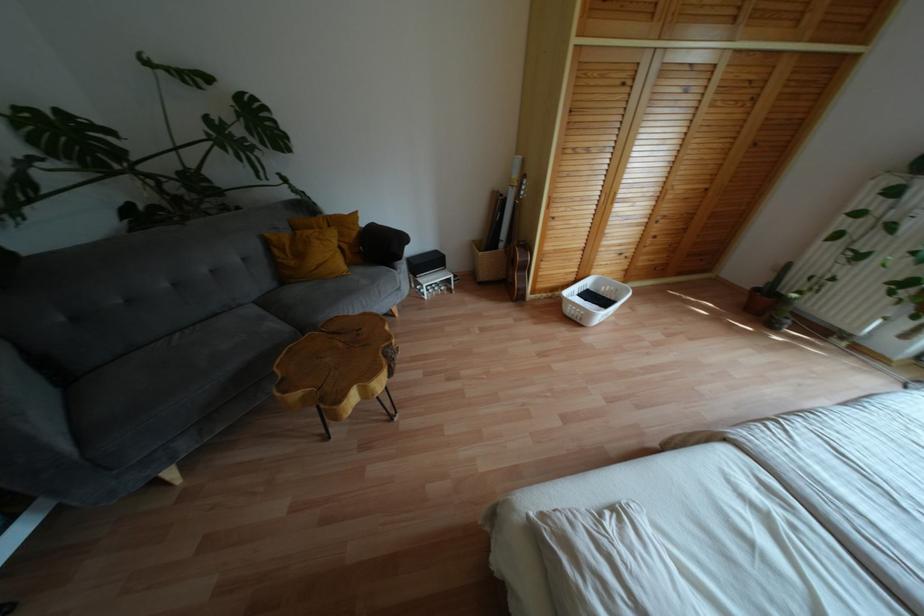
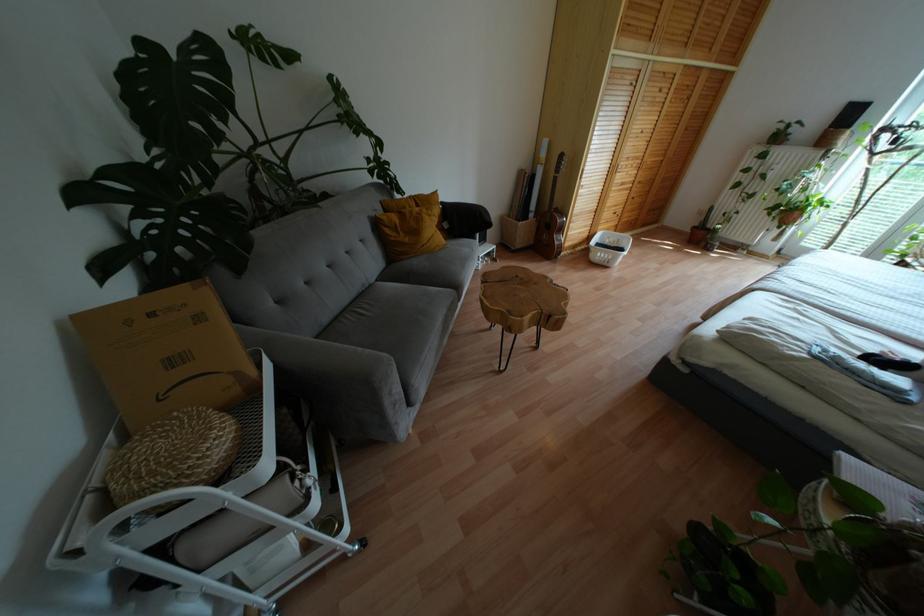
Where in the second image is the point corresponding to (343,267) from the first image?

(443, 240)